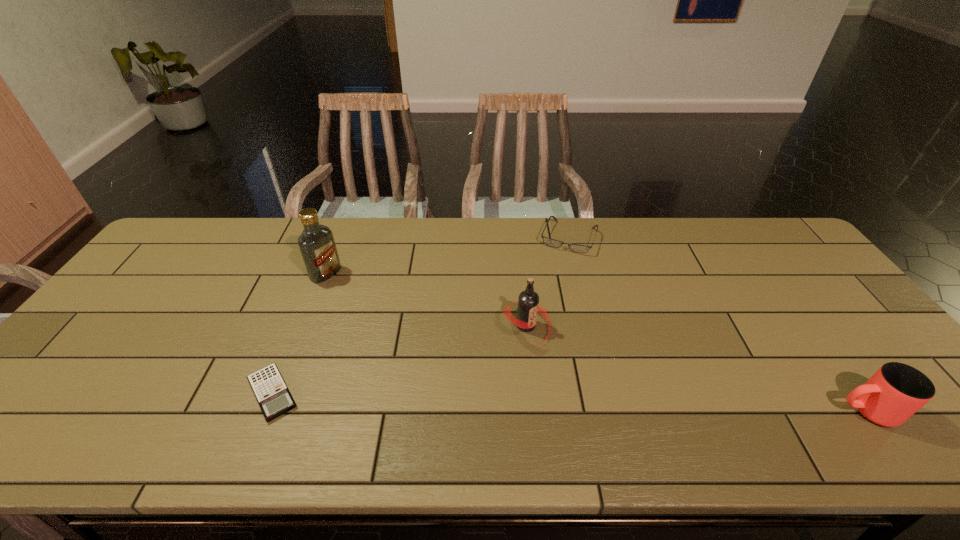
This screenshot has height=540, width=960. In order to click on vacant area that lies between the third shortest object and the shortest object in this screenshot , I will do `click(569, 402)`.

Find the location of a particular element. blank region between the calculator and the fourth object from left to right is located at coordinates (420, 315).

Where is `unoccupied position between the vodka and the farthest object`? unoccupied position between the vodka and the farthest object is located at coordinates (447, 255).

Identify the location of the second closest object relative to the calculator. The height and width of the screenshot is (540, 960). (528, 304).

Where is `object that is the nearest to the third shortest object`? This screenshot has width=960, height=540. object that is the nearest to the third shortest object is located at coordinates (528, 304).

At what (x,y) coordinates should I click in order to perform the action: click on vacant region that satisfies the following two spatial constraints: 1. on the front side of the cup; 2. on the handle side of the fourth tallest object. Please return your answer as a coordinate pair (x, y). Looking at the image, I should click on (611, 411).

Locate an element on the screen. The image size is (960, 540). free space that satisfies the following two spatial constraints: 1. on the back side of the shortest object; 2. on the left side of the third nearest object is located at coordinates (x=300, y=326).